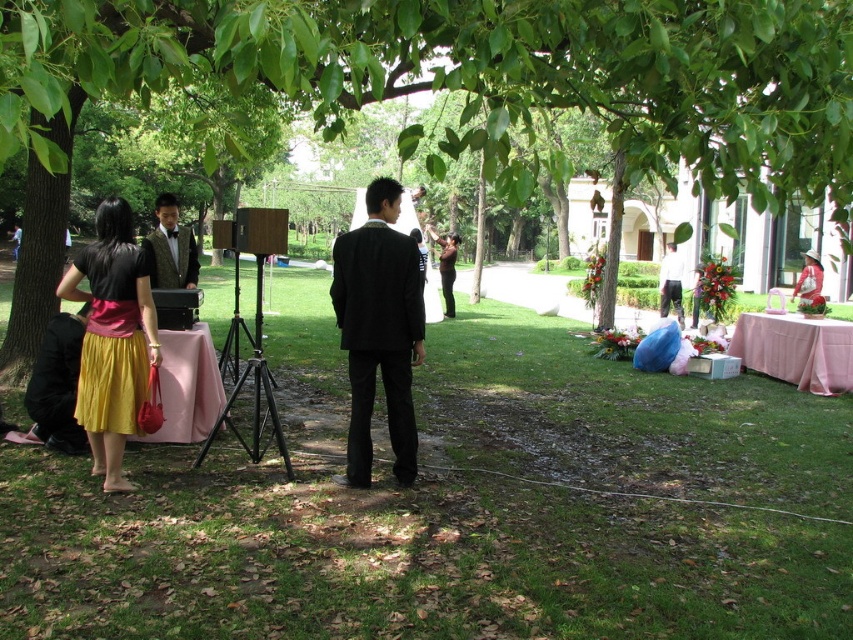
Is yellow satin dress at lower left positioned in front of shiny black vest at center?

Yes, it is in front of shiny black vest at center.

Describe the element at coordinates (112, 344) in the screenshot. I see `yellow satin dress at lower left` at that location.

In the scene shown: Who is more distant from viewer, (126,262) or (190,316)?

Positioned behind is point (190,316).

Locate an element on the screen. yellow satin dress at lower left is located at coordinates (112, 344).

Is point (137, 76) more distant than point (399, 396)?

No, it is in front of (399, 396).

Can you confirm if green leafy tree at center is thinner than black matte suit at center?

Incorrect, green leafy tree at center's width is not less than black matte suit at center's.

Is point (4, 138) positioned after point (399, 404)?

No, (4, 138) is closer to viewer.

Locate an element on the screen. Image resolution: width=853 pixels, height=640 pixels. green leafy tree at center is located at coordinates (483, 76).

Locate an element on the screen. The height and width of the screenshot is (640, 853). green leafy tree at center is located at coordinates (483, 76).

Describe the element at coordinates (483, 76) in the screenshot. I see `green leafy tree at center` at that location.

The image size is (853, 640). What do you see at coordinates (483, 76) in the screenshot?
I see `green leafy tree at center` at bounding box center [483, 76].

This screenshot has width=853, height=640. Identify the location of green leafy tree at center. (483, 76).